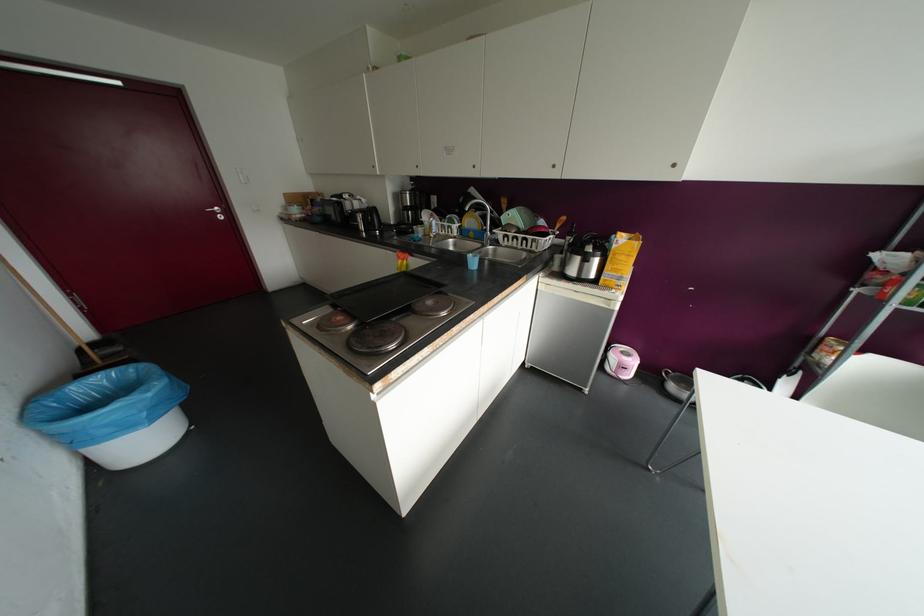
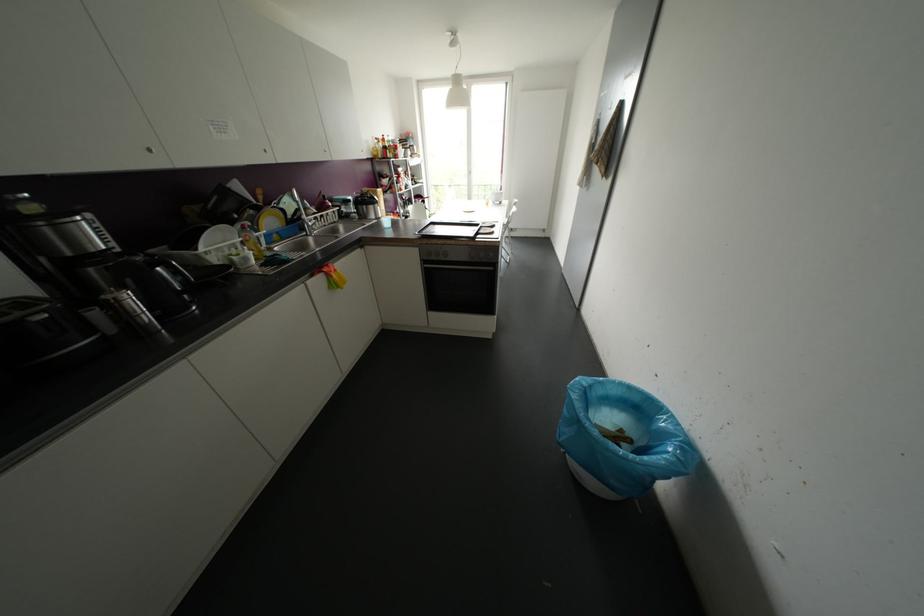
Locate, in the second image, the point that corresponds to [441,284] in the first image.

(432, 220)